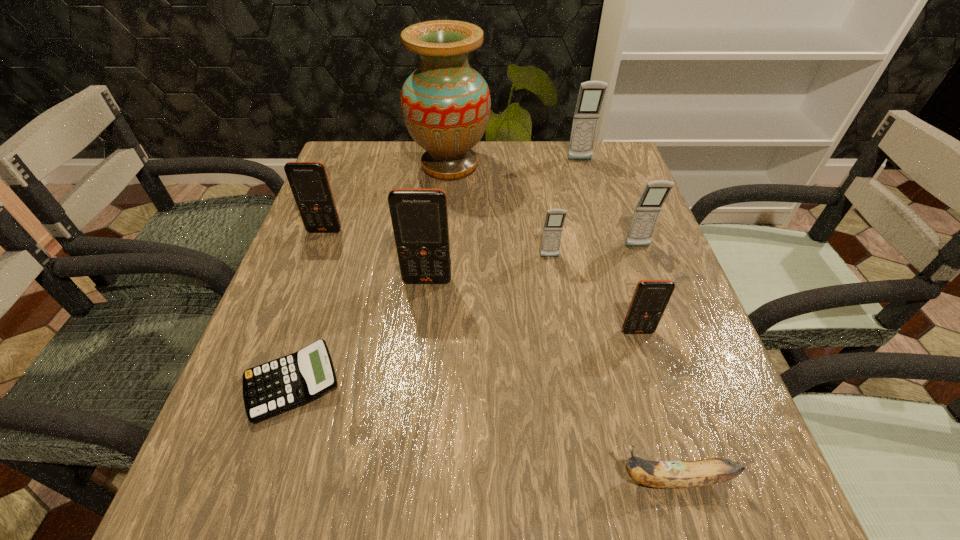
Locate an element on the screen. The width and height of the screenshot is (960, 540). free region located on the front-facing side of the second biggest gray cellular telephone is located at coordinates (689, 388).

Locate an element on the screen. The image size is (960, 540). free region located on the screen of the third farthest object is located at coordinates 288,328.

The height and width of the screenshot is (540, 960). I want to click on free spot located on the screen of the smallest orange cellular telephone, so click(x=688, y=496).

This screenshot has width=960, height=540. I want to click on vacant space located 0.210m on the front-facing side of the leftmost gray cellular telephone, so click(x=563, y=339).

At what (x,y) coordinates should I click in order to perform the action: click on free spot located on the peel of the second shortest object. Please return your answer as a coordinate pair (x, y). The image size is (960, 540). Looking at the image, I should click on (517, 480).

The width and height of the screenshot is (960, 540). I want to click on free location located 0.210m on the peel of the second shortest object, so click(x=469, y=480).

Identify the location of free region located on the peel of the second shortest object. (469, 480).

Find the location of a particular element. The width and height of the screenshot is (960, 540). free region located 0.310m on the right of the eighth farthest object is located at coordinates (526, 384).

This screenshot has width=960, height=540. Find the location of `vase positioned at the far edge`. vase positioned at the far edge is located at coordinates (445, 103).

Locate an element on the screen. This screenshot has width=960, height=540. cellular telephone that is at the far edge is located at coordinates (591, 94).